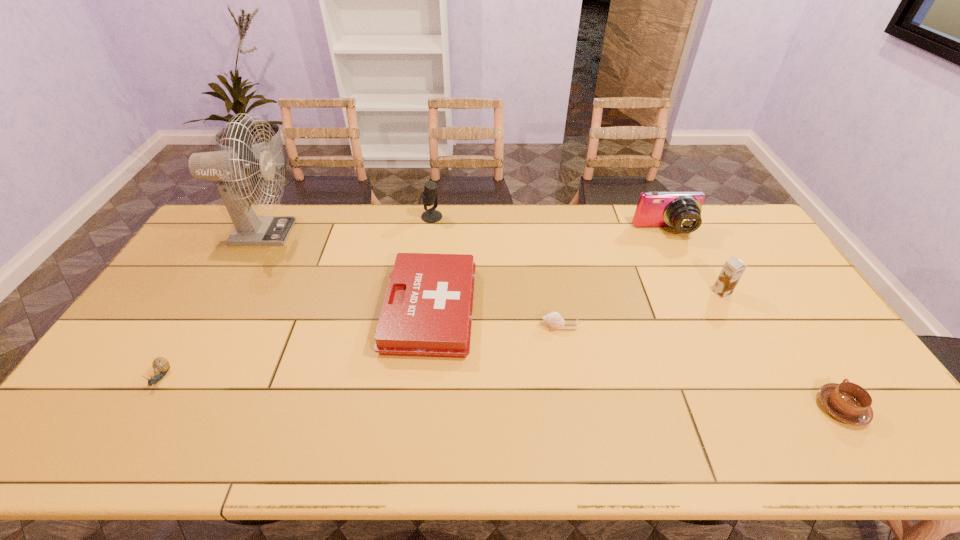
You are a GUI agent. You are given a task and a screenshot of the screen. Output one action in this format:
    pyautogui.click(x=<x>, y=<y>)
    Task: Click on the free spot at the far edge of the desktop
    
    Given the screenshot: What is the action you would take?
    point(311,226)

Image resolution: width=960 pixels, height=540 pixels. Find the location of `free spot at the near edge of the desktop`. free spot at the near edge of the desktop is located at coordinates (350, 433).

Locate an element on the screen. vacant space at the left edge is located at coordinates (168, 321).

Identify the location of vacant area at the right edge. This screenshot has width=960, height=540. (834, 362).

Locate an element on the screen. The height and width of the screenshot is (540, 960). vacant space in between the camera and the chocolate milk is located at coordinates (693, 262).

Locate an element on the screen. This screenshot has height=540, width=960. free area in between the rightmost object and the left escargot is located at coordinates (501, 393).

Locate an element on the screen. free spot between the chocolate milk and the fan is located at coordinates (491, 262).

At what (x,y) coordinates should I click in order to perform the action: click on unoccupied position between the chocolate milk and the rightmost object. Please return your answer as a coordinate pair (x, y). Looking at the image, I should click on (781, 350).

Image resolution: width=960 pixels, height=540 pixels. In order to click on free area in between the microphone and the nearer escargot in this screenshot , I will do 297,297.

You are a GUI agent. You are given a task and a screenshot of the screen. Output one action in this format:
    pyautogui.click(x=<x>, y=<y>)
    Task: Click on the blank region between the cappuccino and the microphone
    Image resolution: width=960 pixels, height=540 pixels.
    Given the screenshot: What is the action you would take?
    pyautogui.click(x=636, y=312)